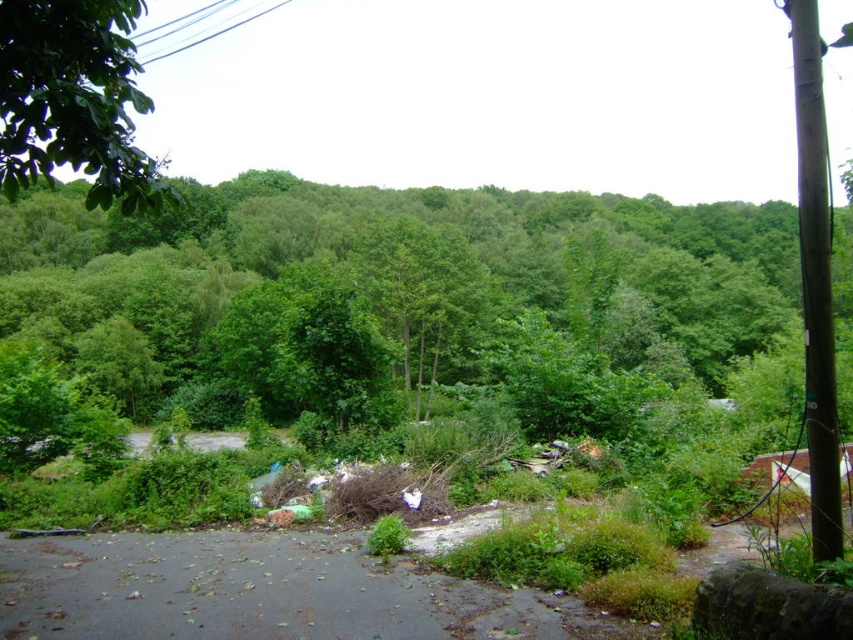
You are a photographer standing in the middle of the paved area. You want to take a photo of the green leafy tree at upper left and the black wire at upper left. Which object should you move towards to get a better view of both?

To get a better view of both the green leafy tree at upper left and the black wire at upper left, you should move towards the green leafy tree at upper left since it is positioned to the right of the black wire at upper left, allowing you to frame both in your shot more effectively.

You are standing at the edge of the paved area in the scene. There are two points marked in the image, point 1 at coordinates point (12,36) and point 2 at coordinates point (264,4). Which point is closer to you?

Point (12,36) is closer to the camera than point (264,4), so the point closer to you is point (12,36).